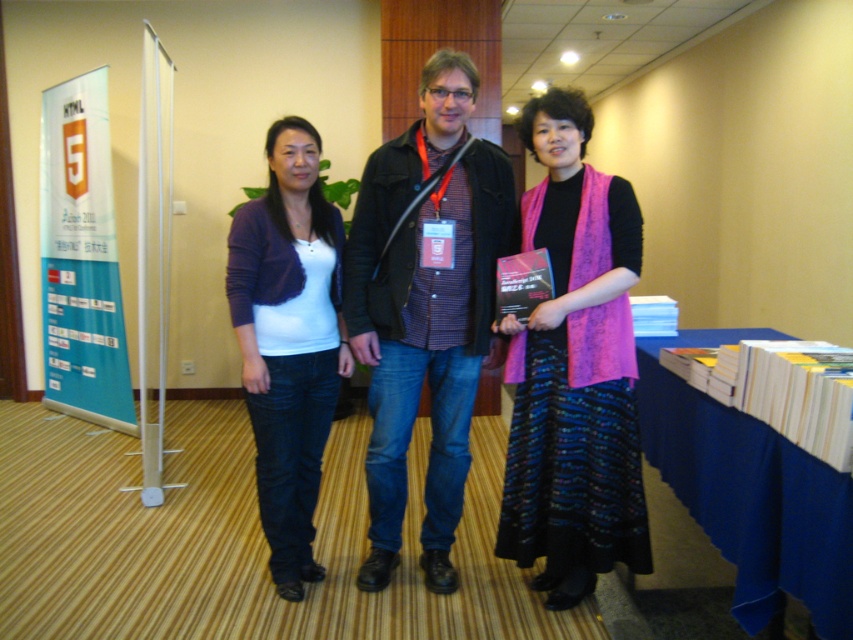
You are standing in front of the three people at the conference. You want to hand a document to the person at point (x=460, y=211) and then to the person at point (x=590, y=396). Which person will you approach first?

You should approach the person at point (x=460, y=211) first because they are closer to you than the person at point (x=590, y=396).

Consider the image. You are organizing a clothing donation drive and need to determine if the matte black jacket at center and the pink knitted scarf at center can fit together in a standard donation box that measures 30 cm in width. Based on their sizes, can both items fit side by side?

The matte black jacket at center is wider than the pink knitted scarf at center. However, since the exact widths aren not provided, we can only compare their relative sizes. If the total width of both items combined exceeds 30 cm, they won t fit. Without specific measurements, it s uncertain.

You are standing in the conference room and want to place a laptop on the nearest surface. Which object should you choose between the matte purple cardigan at center and the blue fabric table at lower right?

You should choose the blue fabric table at lower right because it is a surface designed for placing items, while the matte purple cardigan at center is clothing and not suitable for placing a laptop.